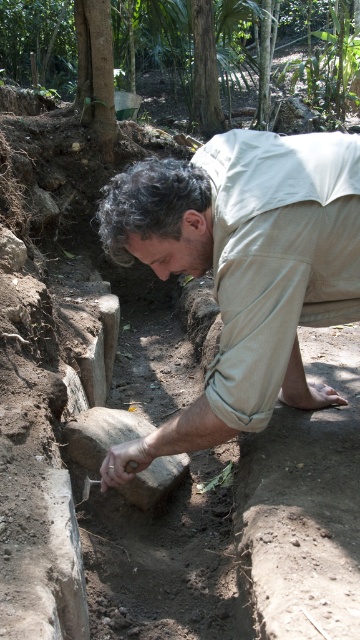
You are an archaeologist observing the excavation site. You notice the beige cotton shirt at center and the brown leather glove at lower center. Which item is located more to the right side of the scene?

The beige cotton shirt at center is positioned on the right side of the brown leather glove at lower center, so it is more to the right in the scene.

You are an archaeologist working at the excavation site. You need to check the texture of the soil in the trench. To do this, you must first remove the beige cotton shirt at center. Will the brown leather glove at lower center be visible after removing the shirt?

The beige cotton shirt at center is positioned over brown leather glove at lower center, so removing the shirt will make the glove visible.